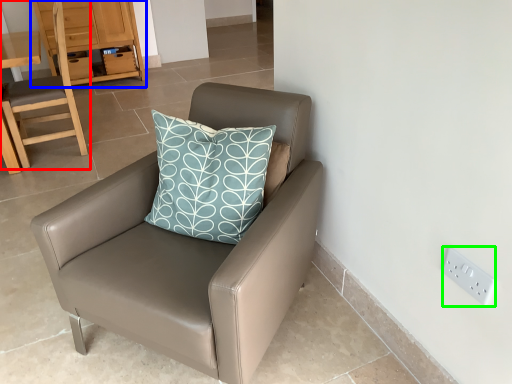
Question: Which is nearer to the chair (highlighted by a red box)? dresser (highlighted by a blue box) or electric outlet (highlighted by a green box).

Choices:
 (A) dresser
 (B) electric outlet

Answer: (A)